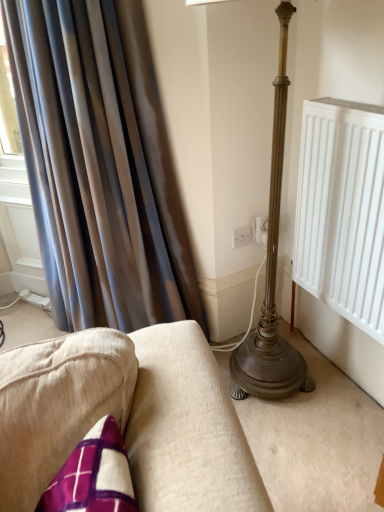
Describe the element at coordinates (261, 230) in the screenshot. The height and width of the screenshot is (512, 384). I see `white plastic socket at center, which is the 1th electric outlet from right to left` at that location.

Identify the location of white plastic socket at center, arranged as the second electric outlet when viewed from the left. The width and height of the screenshot is (384, 512). (261, 230).

Is white plastic socket at center, arranged as the second electric outlet when viewed from the left, surrounded by silky brown curtain at left?

No.

Looking at their sizes, would you say silky brown curtain at left is wider or thinner than white plastic socket at center, which is the 1th electric outlet from right to left?

In the image, silky brown curtain at left appears to be wider than white plastic socket at center, which is the 1th electric outlet from right to left.

Can you confirm if silky brown curtain at left is bigger than white plastic socket at center, arranged as the second electric outlet when viewed from the left?

Correct, silky brown curtain at left is larger in size than white plastic socket at center, arranged as the second electric outlet when viewed from the left.

Is silky brown curtain at left to the right of white plastic socket at center, which is the 1th electric outlet from right to left, from the viewer's perspective?

Incorrect, silky brown curtain at left is not on the right side of white plastic socket at center, which is the 1th electric outlet from right to left.

Which point is more distant from viewer, (252, 238) or (263, 227)?

The point (252, 238) is farther.

Can white plastic socket at center, arranged as the second electric outlet when viewed from the left, be found inside white plastic electric outlet at center, which is the first electric outlet in left-to-right order?

No.

Is white plastic electric outlet at center, which is the first electric outlet in left-to-right order, wider than white plastic socket at center, which is the 1th electric outlet from right to left?

No, white plastic electric outlet at center, which is the first electric outlet in left-to-right order, is not wider than white plastic socket at center, which is the 1th electric outlet from right to left.

At what (x,y) coordinates should I click in order to perform the action: click on electric outlet on the right of white plastic electric outlet at center, which is the first electric outlet in left-to-right order. Please return your answer as a coordinate pair (x, y). Image resolution: width=384 pixels, height=512 pixels. Looking at the image, I should click on (261, 230).

Identify the location of curtain above the white plastic socket at center, which is the 1th electric outlet from right to left (from a real-world perspective). click(100, 165).

Does white plastic socket at center, arranged as the second electric outlet when viewed from the left, have a smaller size compared to silky brown curtain at left?

Correct, white plastic socket at center, arranged as the second electric outlet when viewed from the left, occupies less space than silky brown curtain at left.

Could you measure the distance between white plastic socket at center, which is the 1th electric outlet from right to left, and silky brown curtain at left?

70.86 centimeters.

Are white plastic socket at center, which is the 1th electric outlet from right to left, and silky brown curtain at left far apart?

No, white plastic socket at center, which is the 1th electric outlet from right to left, is not far from silky brown curtain at left.

From a real-world perspective, does silky brown curtain at left stand above white plastic electric outlet at center, which is the first electric outlet in left-to-right order?

Yes, from a real-world perspective, silky brown curtain at left is above white plastic electric outlet at center, which is the first electric outlet in left-to-right order.

Based on the photo, who is more distant, silky brown curtain at left or white plastic electric outlet at center, which is the first electric outlet in left-to-right order?

white plastic electric outlet at center, which is the first electric outlet in left-to-right order, is further away from the camera.

Can you tell me how much silky brown curtain at left and white plastic electric outlet at center, which is counted as the second electric outlet, starting from the right, differ in facing direction?

58.5 degrees.

From the image's perspective, is silky brown curtain at left located above white plastic electric outlet at center, which is counted as the second electric outlet, starting from the right?

Yes.

Looking at this image, how different are the orientations of white plastic electric outlet at center, which is counted as the second electric outlet, starting from the right, and silky brown curtain at left in degrees?

The facing directions of white plastic electric outlet at center, which is counted as the second electric outlet, starting from the right, and silky brown curtain at left are 58.5 degrees apart.

Is white plastic electric outlet at center, which is counted as the second electric outlet, starting from the right, positioned far away from silky brown curtain at left?

white plastic electric outlet at center, which is counted as the second electric outlet, starting from the right, is near silky brown curtain at left, not far away.

From the image's perspective, is white plastic electric outlet at center, which is counted as the second electric outlet, starting from the right, located above or below silky brown curtain at left?

white plastic electric outlet at center, which is counted as the second electric outlet, starting from the right, is situated lower than silky brown curtain at left in the image.

Who is taller, white plastic electric outlet at center, which is counted as the second electric outlet, starting from the right, or silky brown curtain at left?

Standing taller between the two is silky brown curtain at left.

Which of these two, white plastic socket at center, arranged as the second electric outlet when viewed from the left, or white plastic electric outlet at center, which is the first electric outlet in left-to-right order, is smaller?

With smaller size is white plastic electric outlet at center, which is the first electric outlet in left-to-right order.

Is white plastic socket at center, which is the 1th electric outlet from right to left, outside of white plastic electric outlet at center, which is counted as the second electric outlet, starting from the right?

That's correct, white plastic socket at center, which is the 1th electric outlet from right to left, is outside of white plastic electric outlet at center, which is counted as the second electric outlet, starting from the right.

Considering the relative positions of white plastic socket at center, arranged as the second electric outlet when viewed from the left, and white plastic electric outlet at center, which is the first electric outlet in left-to-right order, in the image provided, is white plastic socket at center, arranged as the second electric outlet when viewed from the left, in front of white plastic electric outlet at center, which is the first electric outlet in left-to-right order,?

That is True.

Locate an element on the screen. Image resolution: width=384 pixels, height=512 pixels. electric outlet that is the 2nd object to the right of the silky brown curtain at left, starting at the anchor is located at coordinates (261, 230).

The width and height of the screenshot is (384, 512). Identify the location of electric outlet below the white plastic socket at center, arranged as the second electric outlet when viewed from the left (from the image's perspective). (242, 236).

From the image, which object appears to be farther from white plastic electric outlet at center, which is the first electric outlet in left-to-right order, silky brown curtain at left or white plastic socket at center, arranged as the second electric outlet when viewed from the left?

silky brown curtain at left.

Looking at the image, which one is located further to white plastic socket at center, arranged as the second electric outlet when viewed from the left, white plastic electric outlet at center, which is the first electric outlet in left-to-right order, or silky brown curtain at left?

Based on the image, silky brown curtain at left appears to be further to white plastic socket at center, arranged as the second electric outlet when viewed from the left.

Considering their positions, is white plastic socket at center, arranged as the second electric outlet when viewed from the left, positioned further to white plastic electric outlet at center, which is the first electric outlet in left-to-right order, than silky brown curtain at left?

Among the two, silky brown curtain at left is located further to white plastic electric outlet at center, which is the first electric outlet in left-to-right order.

From the picture: Considering their positions, is silky brown curtain at left positioned closer to white plastic socket at center, arranged as the second electric outlet when viewed from the left, than white plastic electric outlet at center, which is the first electric outlet in left-to-right order?

The object closer to white plastic socket at center, arranged as the second electric outlet when viewed from the left, is white plastic electric outlet at center, which is the first electric outlet in left-to-right order.

Estimate the real-world distances between objects in this image. Which object is further from silky brown curtain at left, white plastic electric outlet at center, which is the first electric outlet in left-to-right order, or white plastic socket at center, arranged as the second electric outlet when viewed from the left?

The object further to silky brown curtain at left is white plastic socket at center, arranged as the second electric outlet when viewed from the left.

From the image, which object appears to be farther from silky brown curtain at left, white plastic socket at center, arranged as the second electric outlet when viewed from the left, or white plastic electric outlet at center, which is the first electric outlet in left-to-right order?

white plastic socket at center, arranged as the second electric outlet when viewed from the left.

At what (x,y) coordinates should I click in order to perform the action: click on electric outlet between silky brown curtain at left and white plastic electric outlet at center, which is counted as the second electric outlet, starting from the right, from front to back. Please return your answer as a coordinate pair (x, y). Image resolution: width=384 pixels, height=512 pixels. Looking at the image, I should click on (261, 230).